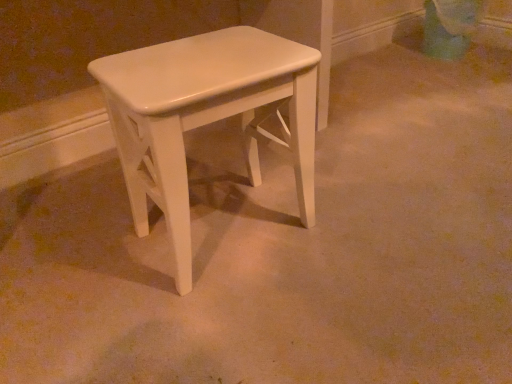
Question: Can you confirm if white glossy stool at center is smaller than matte green swivel chair at upper right?

Choices:
 (A) no
 (B) yes

Answer: (A)

Question: Is white glossy stool at center facing towards matte green swivel chair at upper right?

Choices:
 (A) yes
 (B) no

Answer: (B)

Question: Is white glossy stool at center located outside matte green swivel chair at upper right?

Choices:
 (A) no
 (B) yes

Answer: (B)

Question: Are white glossy stool at center and matte green swivel chair at upper right located far from each other?

Choices:
 (A) no
 (B) yes

Answer: (B)

Question: Is white glossy stool at center thinner than matte green swivel chair at upper right?

Choices:
 (A) no
 (B) yes

Answer: (A)

Question: Is white glossy stool at center bigger than matte green swivel chair at upper right?

Choices:
 (A) yes
 (B) no

Answer: (A)

Question: Are matte green swivel chair at upper right and white glossy stool at center located far from each other?

Choices:
 (A) no
 (B) yes

Answer: (B)

Question: Does matte green swivel chair at upper right have a lesser height compared to white glossy stool at center?

Choices:
 (A) yes
 (B) no

Answer: (A)

Question: From the image's perspective, is matte green swivel chair at upper right on white glossy stool at center?

Choices:
 (A) yes
 (B) no

Answer: (A)

Question: Is matte green swivel chair at upper right closer to the viewer compared to white glossy stool at center?

Choices:
 (A) yes
 (B) no

Answer: (B)

Question: From a real-world perspective, does matte green swivel chair at upper right stand above white glossy stool at center?

Choices:
 (A) yes
 (B) no

Answer: (B)

Question: Does matte green swivel chair at upper right turn towards white glossy stool at center?

Choices:
 (A) no
 (B) yes

Answer: (B)

Question: Looking at their shapes, would you say matte green swivel chair at upper right is wider or thinner than white glossy stool at center?

Choices:
 (A) thin
 (B) wide

Answer: (A)